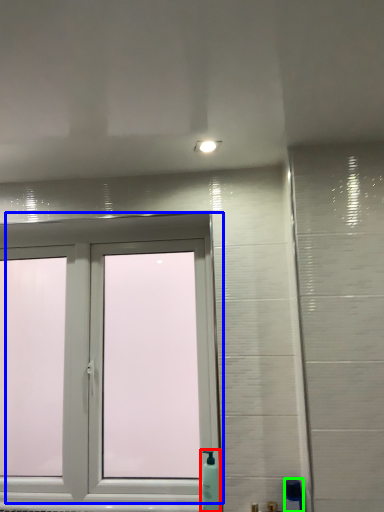
Question: Considering the real-world distances, which object is farthest from soap dispenser (highlighted by a red box)? window (highlighted by a blue box) or soap dispenser (highlighted by a green box)?

Choices:
 (A) window
 (B) soap dispenser

Answer: (A)